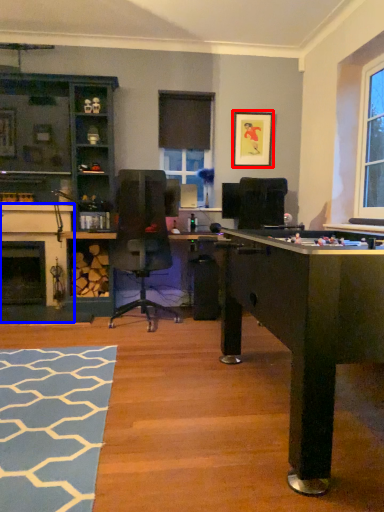
Question: Which of the following is the farthest to the observer, picture frame (highlighted by a red box) or fireplace (highlighted by a blue box)?

Choices:
 (A) picture frame
 (B) fireplace

Answer: (A)